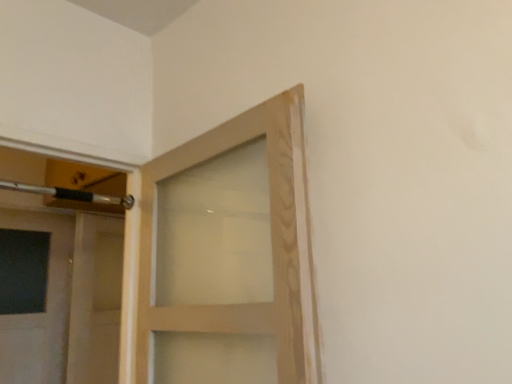
Question: From a real-world perspective, is matte wood door at center below metallic silver door handle at upper left?

Choices:
 (A) yes
 (B) no

Answer: (A)

Question: Does matte wood door at center appear on the right side of metallic silver door handle at upper left?

Choices:
 (A) yes
 (B) no

Answer: (B)

Question: Considering the relative sizes of matte wood door at center and metallic silver door handle at upper left in the image provided, is matte wood door at center wider than metallic silver door handle at upper left?

Choices:
 (A) yes
 (B) no

Answer: (A)

Question: From the image's perspective, is matte wood door at center beneath metallic silver door handle at upper left?

Choices:
 (A) no
 (B) yes

Answer: (B)

Question: Can you confirm if matte wood door at center is taller than metallic silver door handle at upper left?

Choices:
 (A) yes
 (B) no

Answer: (A)

Question: Is matte wood door at center aimed at metallic silver door handle at upper left?

Choices:
 (A) yes
 (B) no

Answer: (B)

Question: Does metallic silver door handle at upper left contain matte wood door at center?

Choices:
 (A) no
 (B) yes

Answer: (A)

Question: From a real-world perspective, is metallic silver door handle at upper left on top of matte wood door at center?

Choices:
 (A) yes
 (B) no

Answer: (A)

Question: Is metallic silver door handle at upper left thinner than matte wood door at center?

Choices:
 (A) yes
 (B) no

Answer: (A)

Question: Is metallic silver door handle at upper left outside of matte wood door at center?

Choices:
 (A) yes
 (B) no

Answer: (A)

Question: Is metallic silver door handle at upper left positioned behind matte wood door at center?

Choices:
 (A) yes
 (B) no

Answer: (B)

Question: From the image's perspective, is metallic silver door handle at upper left on matte wood door at center?

Choices:
 (A) no
 (B) yes

Answer: (B)

Question: Considering the positions of matte wood door at center and metallic silver door handle at upper left in the image, is matte wood door at center taller or shorter than metallic silver door handle at upper left?

Choices:
 (A) short
 (B) tall

Answer: (B)